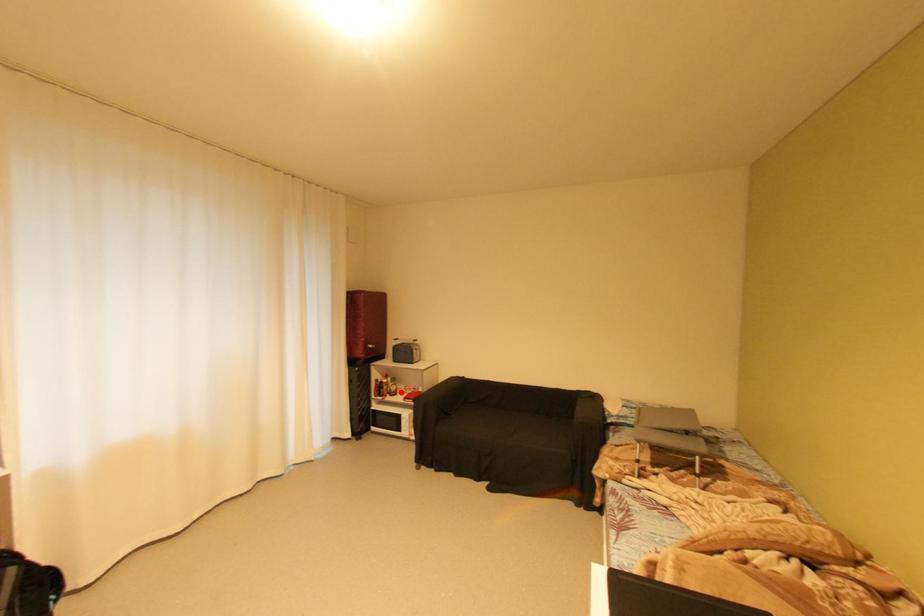
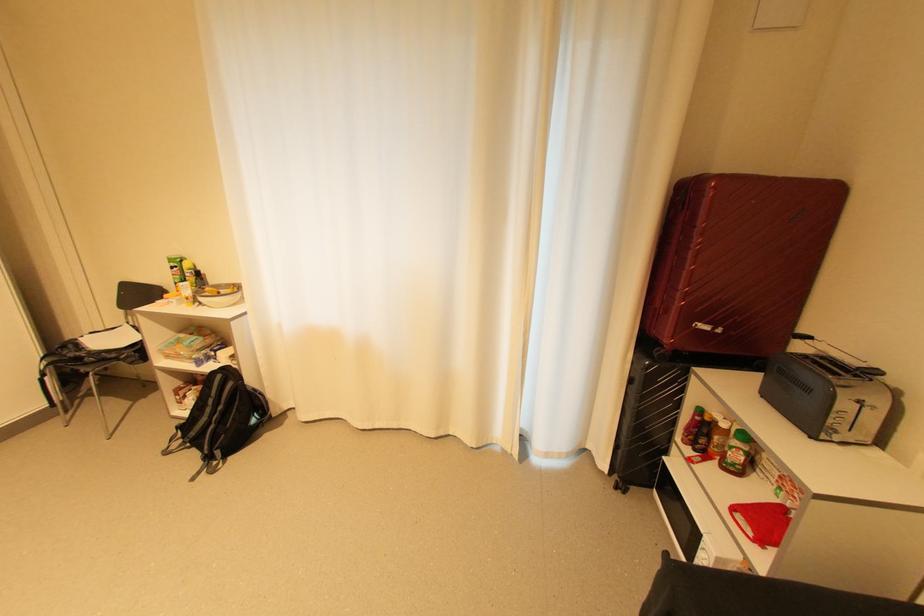
Question: A red point is marked in image1. In image2, is the corresponding 3D point closer to the camera or farther? Reply with the corresponding letter.

Choices:
 (A) The corresponding 3D point is closer.
 (B) The corresponding 3D point is farther.

Answer: (A)